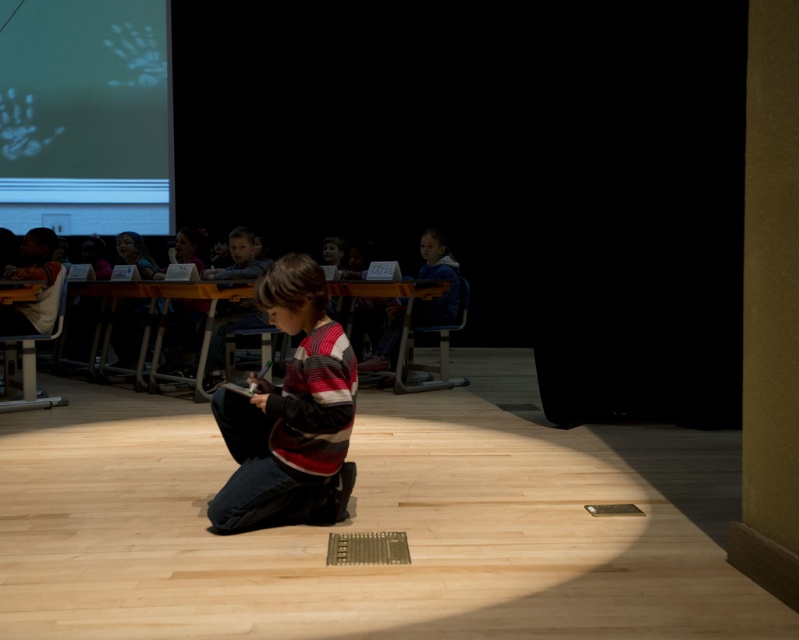
Question: Which point appears farthest from the camera in this image?

Choices:
 (A) (344, 410)
 (B) (0, 184)
 (C) (446, 314)

Answer: (B)

Question: Does white matte projection screen at upper left appear on the right side of striped sweater at center?

Choices:
 (A) no
 (B) yes

Answer: (A)

Question: Is white matte projection screen at upper left to the left of striped sweater at center from the viewer's perspective?

Choices:
 (A) no
 (B) yes

Answer: (B)

Question: Which point is closer to the camera?

Choices:
 (A) (440, 240)
 (B) (56, 33)

Answer: (A)

Question: Does white matte projection screen at upper left appear under striped sweater at center?

Choices:
 (A) no
 (B) yes

Answer: (A)

Question: Which object is positioned farthest from the blue fleece jacket at center?

Choices:
 (A) striped sweater at center
 (B) white matte projection screen at upper left

Answer: (B)